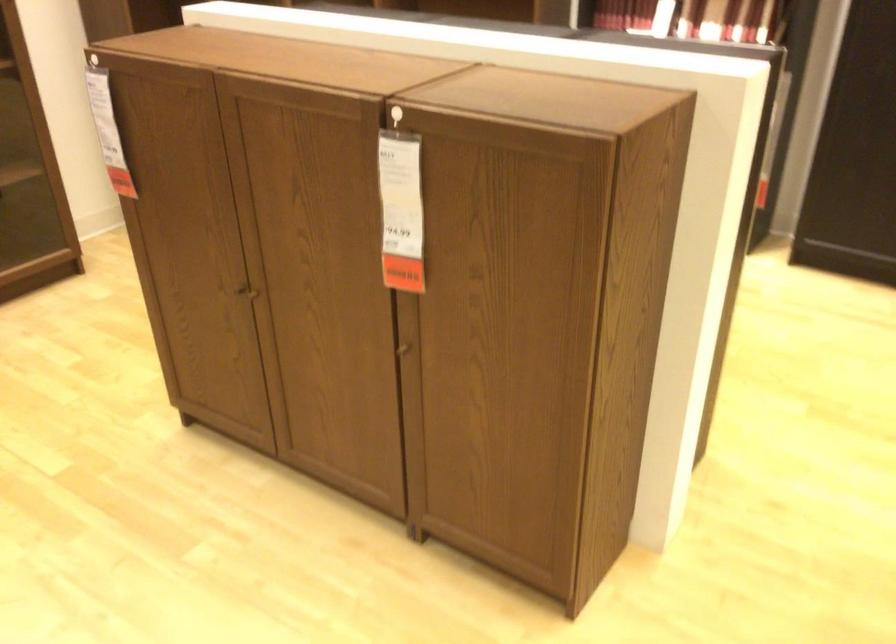
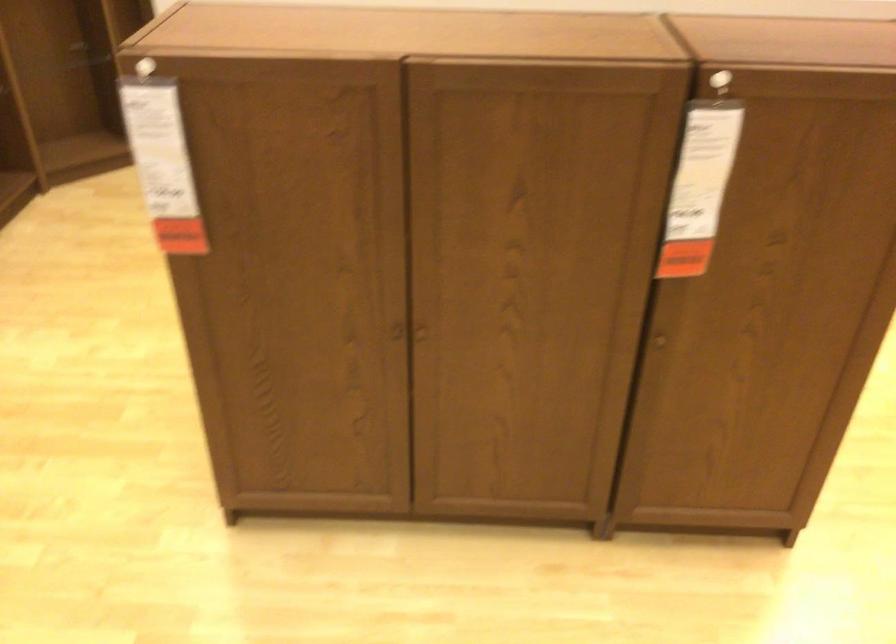
In the second image, find the point that corresponds to [108,128] in the first image.

(162, 164)